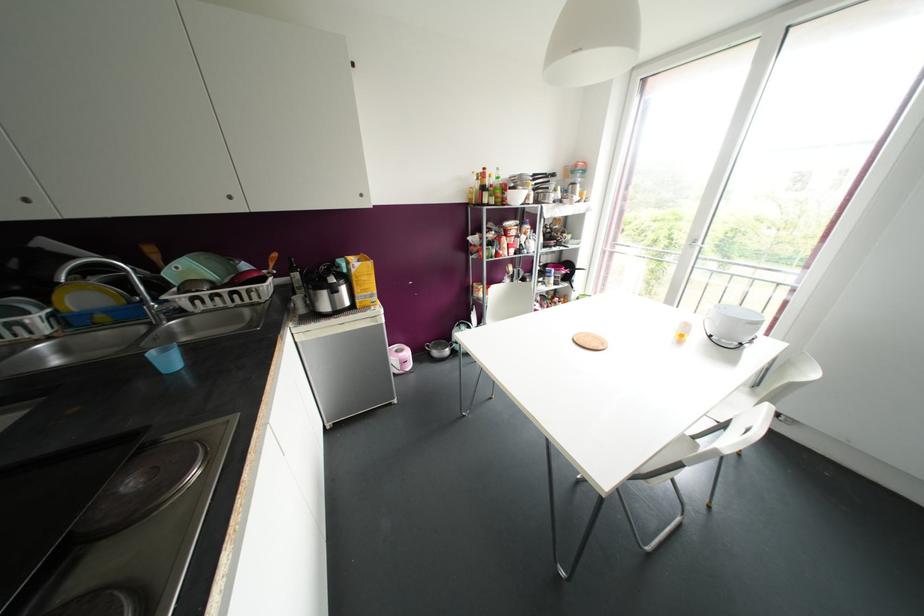
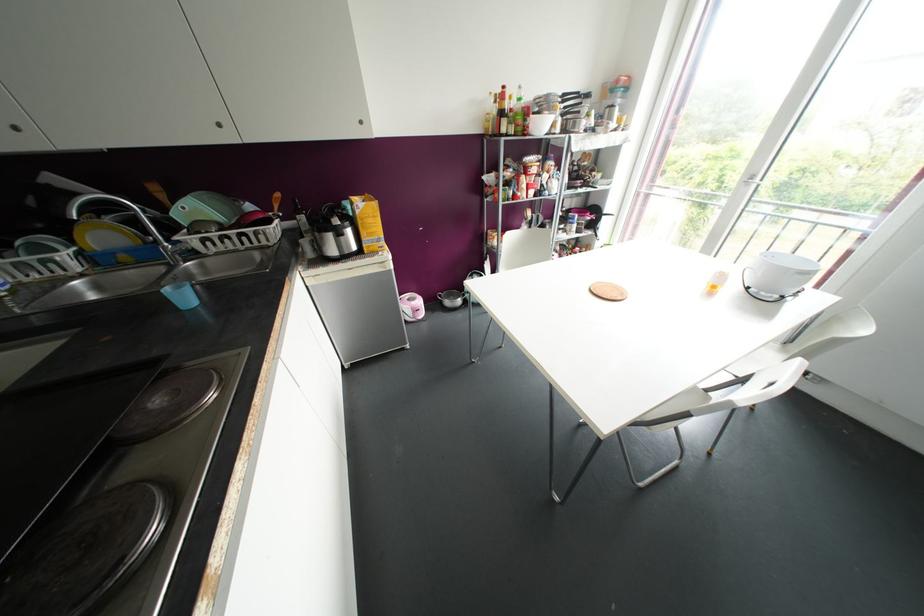
Where in the second image is the point corresponding to [363,277] from the first image?

(370, 220)